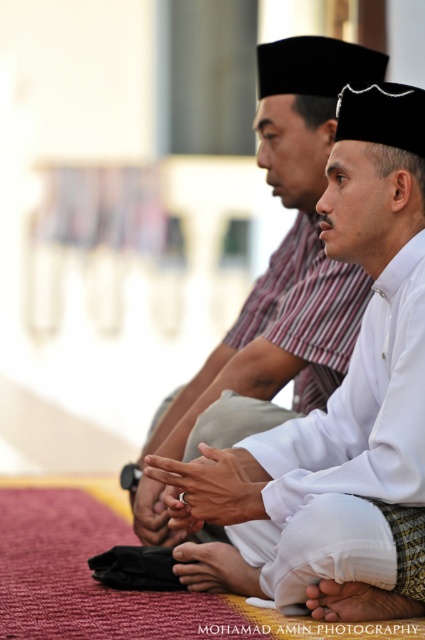
Does point (292, 403) come farther from viewer compared to point (257, 483)?

Yes, it is.

Identify the location of white matte shirt at center. (289, 248).

Between point (274, 356) and point (164, 481), which one is positioned in front?

Point (164, 481)

I want to click on white matte shirt at center, so click(x=289, y=248).

Is point (421, 362) in front of point (365, 611)?

Yes, it is.

What do you see at coordinates (348, 452) in the screenshot?
I see `white matte robe at center` at bounding box center [348, 452].

Is point (367, 422) less distant than point (319, 588)?

No, (367, 422) is further to viewer.

In order to click on white matte robe at center in this screenshot , I will do `click(348, 452)`.

Can you confirm if white matte shirt at center is smaller than white matte hand at center?

No, white matte shirt at center is not smaller than white matte hand at center.

Which is more to the left, white matte shirt at center or white matte hand at center?

white matte hand at center

Find the location of `white matte shirt at center`. white matte shirt at center is located at coordinates (289, 248).